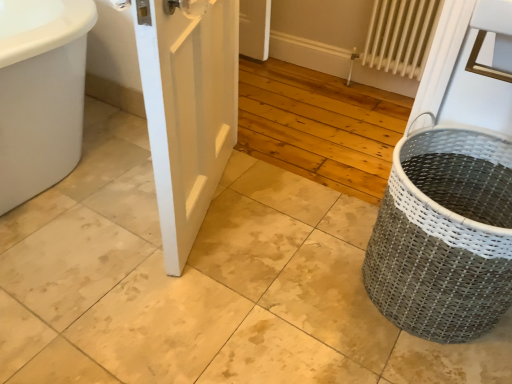
Question: In terms of height, does white matte door at center look taller or shorter compared to white metal radiator at upper right?

Choices:
 (A) short
 (B) tall

Answer: (B)

Question: From a real-world perspective, is white matte door at center positioned above or below white metal radiator at upper right?

Choices:
 (A) above
 (B) below

Answer: (A)

Question: Which object is positioned closest to the white matte door at center?

Choices:
 (A) gray woven basket at right
 (B) white metal radiator at upper right

Answer: (A)

Question: Which of these objects is positioned farthest from the white matte door at center?

Choices:
 (A) gray woven basket at right
 (B) white metal radiator at upper right

Answer: (B)